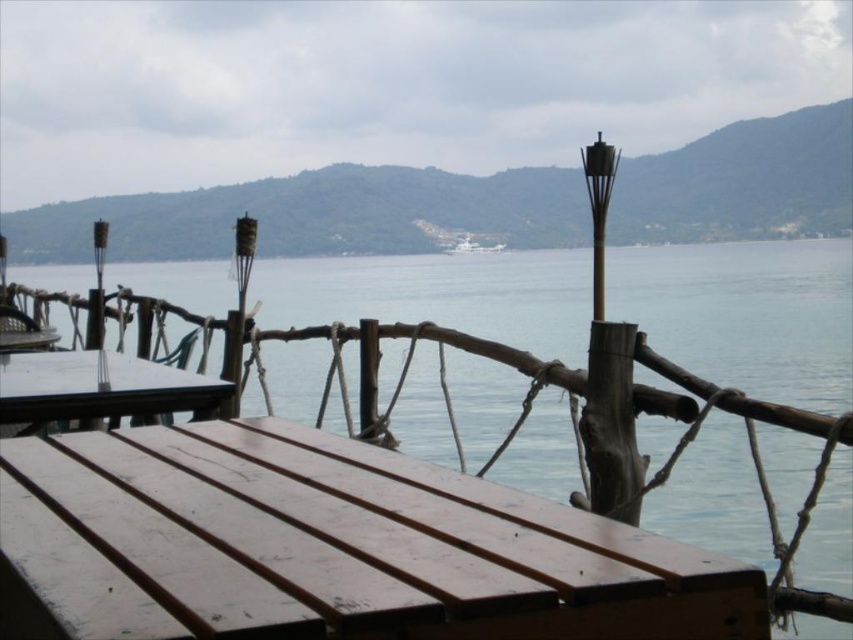
Which is below, wooden picnic table at center or white glossy boat at center?

wooden picnic table at center is below.

Is point (9, 362) positioned behind point (450, 248)?

That is False.

Where is `wooden picnic table at center`? This screenshot has height=640, width=853. wooden picnic table at center is located at coordinates (97, 387).

Can you confirm if wooden bench at lower left is wider than white glossy boat at center?

Yes, wooden bench at lower left is wider than white glossy boat at center.

Who is higher up, wooden bench at lower left or white glossy boat at center?

Positioned higher is white glossy boat at center.

This screenshot has width=853, height=640. Identify the location of wooden bench at lower left. coord(349,545).

Between wooden bench at lower left and wooden picnic table at center, which one has more height?

With more height is wooden picnic table at center.

Is wooden bench at lower left wider than wooden picnic table at center?

No, wooden bench at lower left is not wider than wooden picnic table at center.

Does point (180, 547) lie in front of point (20, 362)?

Yes, it is.

Where is `wooden bench at lower left`? Image resolution: width=853 pixels, height=640 pixels. wooden bench at lower left is located at coordinates (349, 545).